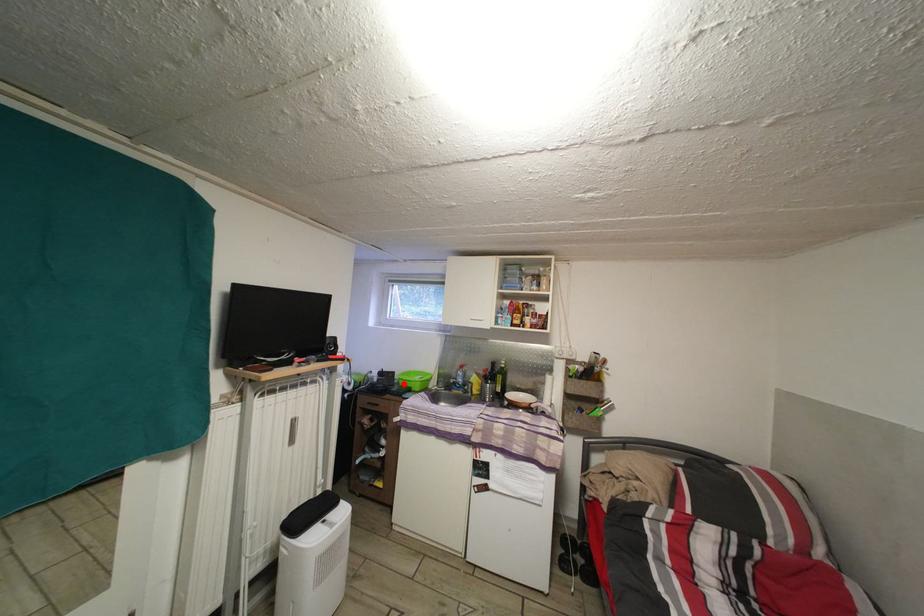
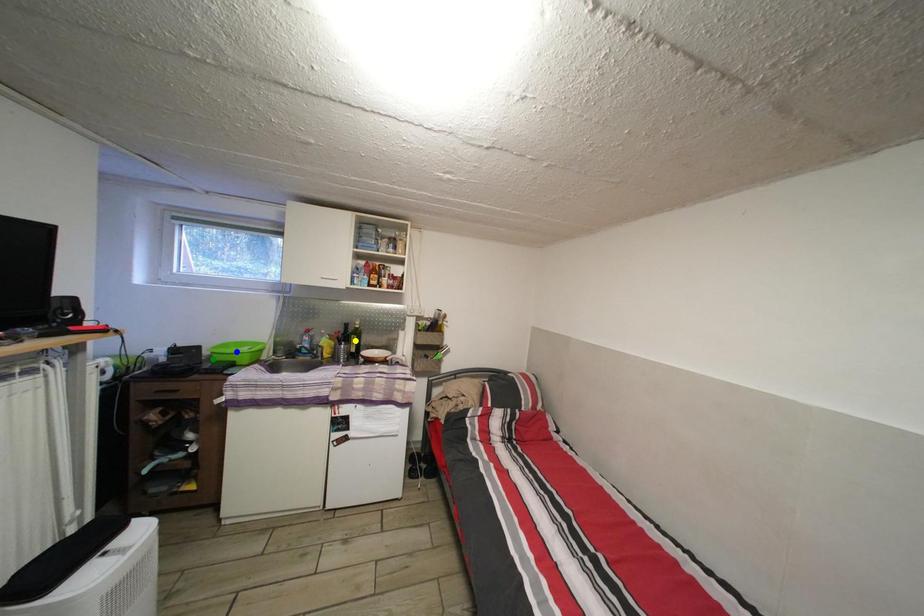
Question: I am providing you with two images of the same scene from different viewpoints. A red point is marked on the first image. You are given multiple points on the second image. Which spot in image 2 lines up with the point in image 1?

Choices:
 (A) green point
 (B) blue point
 (C) yellow point

Answer: (A)